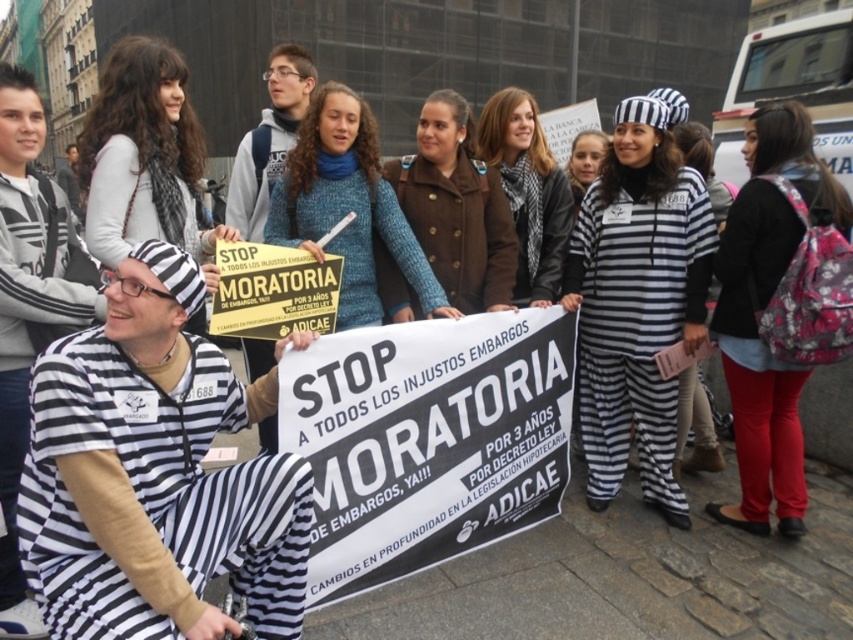
Question: In this image, where is black and white striped prison uniform at center located relative to striped prison uniform at center?

Choices:
 (A) right
 (B) left

Answer: (B)

Question: Among these points, which one is nearest to the camera?

Choices:
 (A) tap(370, 177)
 (B) tap(28, 634)
 (C) tap(587, 180)

Answer: (B)

Question: Does floral-patterned backpack at right have a greater width compared to knitted blue sweater at center?

Choices:
 (A) no
 (B) yes

Answer: (A)

Question: Estimate the real-world distances between objects in this image. Which object is farther from the striped fabric jumpsuit at center?

Choices:
 (A) black and white striped prison uniform at center
 (B) blue knitted sweater at center

Answer: (A)

Question: Which object is positioned farthest from the black and white striped prison uniform at center?

Choices:
 (A) floral-patterned backpack at right
 (B) striped fabric jumpsuit at center
 (C) light gray sweater at upper left
 (D) striped prison uniform at center

Answer: (C)

Question: Considering the relative positions of striped fabric jumpsuit at center and striped prison uniform at center in the image provided, where is striped fabric jumpsuit at center located with respect to striped prison uniform at center?

Choices:
 (A) right
 (B) left

Answer: (B)